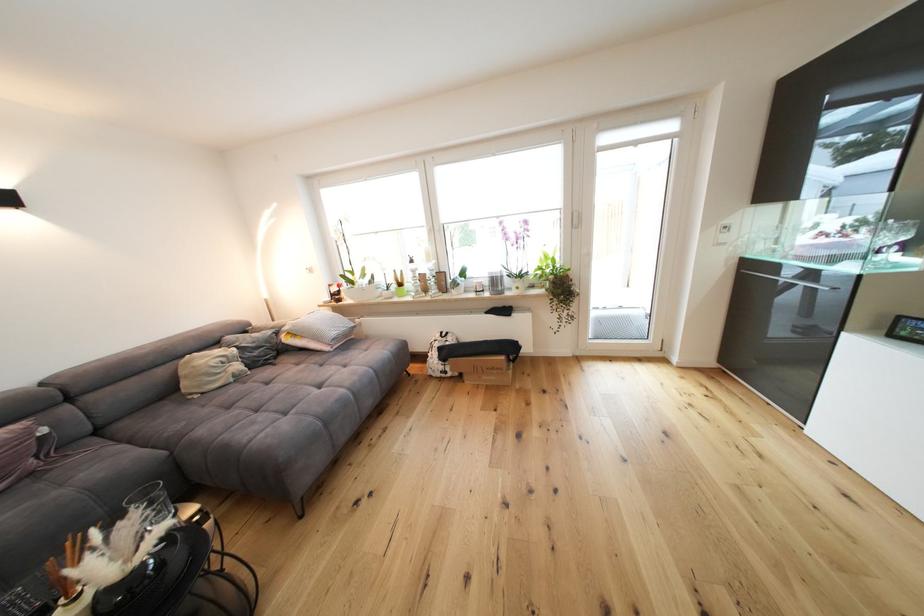
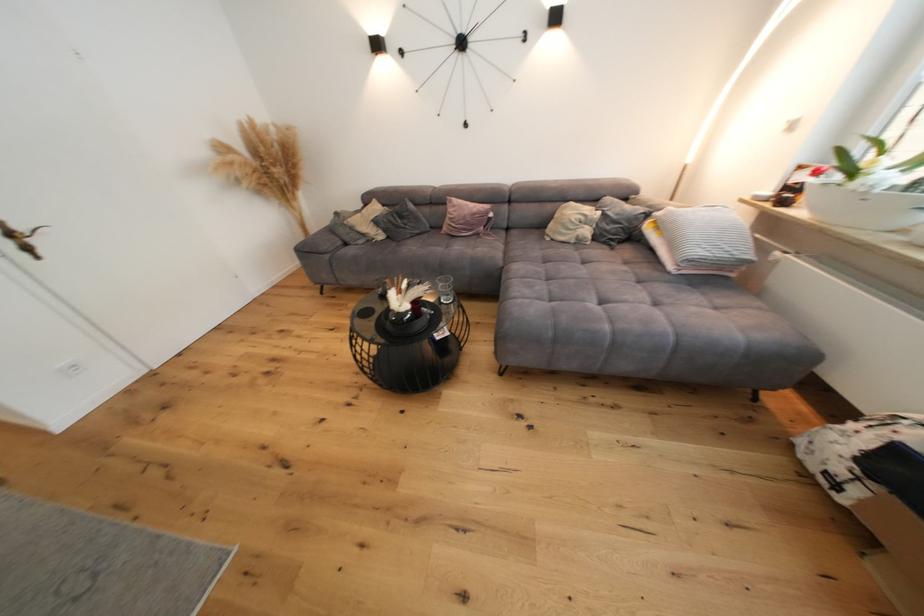
The point at (263,413) is marked in the first image. Where is the corresponding point in the second image?

(553, 282)